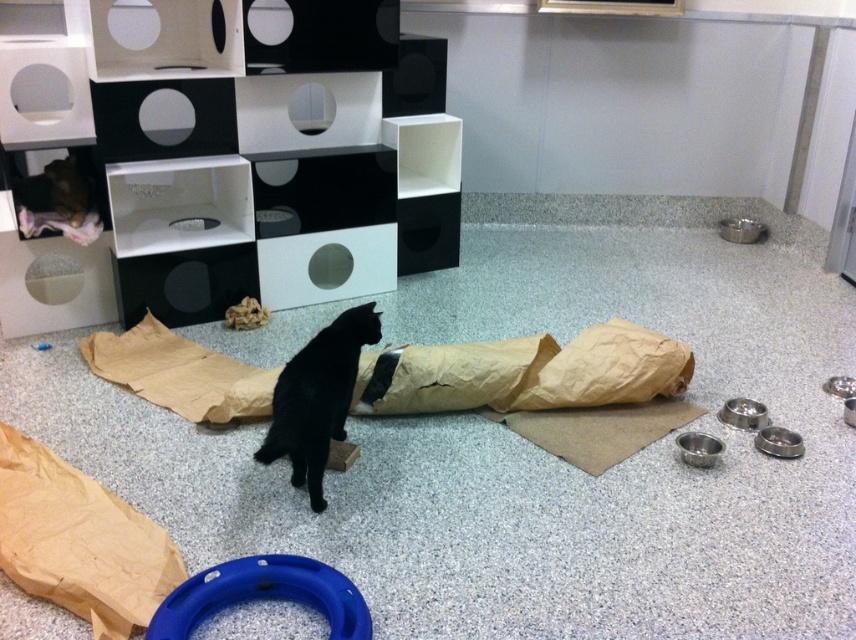
Question: Considering the relative positions of brown crinkled paper bag at lower left and blue rubber ring at lower center in the image provided, where is brown crinkled paper bag at lower left located with respect to blue rubber ring at lower center?

Choices:
 (A) above
 (B) below

Answer: (A)

Question: Which is nearer to the blue rubber ring at lower center?

Choices:
 (A) brown crinkled paper bag at center
 (B) black matte fur cat at center

Answer: (B)

Question: Which object is positioned farthest from the brown crinkled paper bag at center?

Choices:
 (A) brown crinkled paper bag at lower left
 (B) blue rubber ring at lower center

Answer: (A)

Question: Does brown crinkled paper bag at center come in front of black matte fur cat at center?

Choices:
 (A) no
 (B) yes

Answer: (A)

Question: Can you confirm if brown crinkled paper bag at lower left is wider than black matte fur cat at center?

Choices:
 (A) no
 (B) yes

Answer: (B)

Question: Which object is closer to the camera taking this photo?

Choices:
 (A) blue rubber ring at lower center
 (B) black matte fur cat at center

Answer: (A)